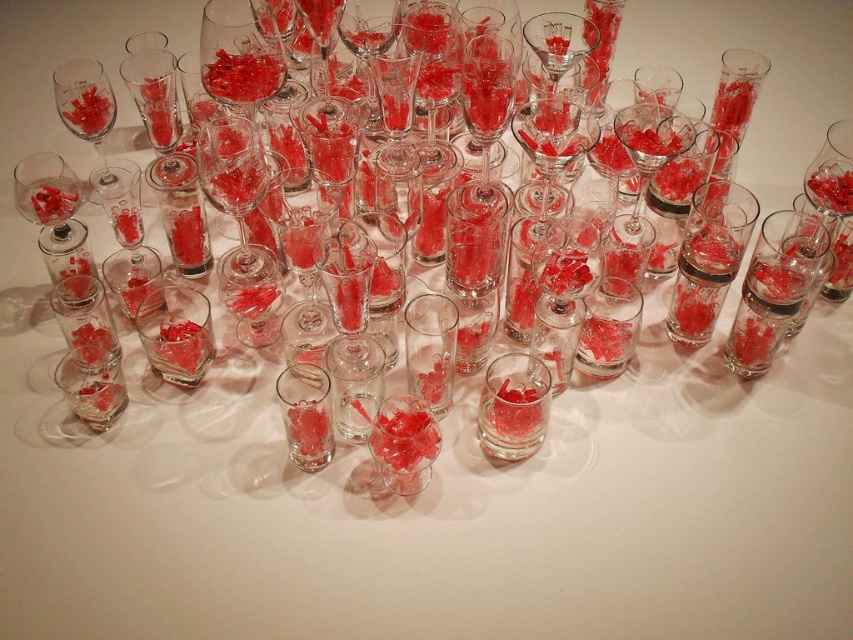
Question: Can you confirm if transparent glass at center is positioned to the left of matte glass wine glass at upper left?

Choices:
 (A) no
 (B) yes

Answer: (A)

Question: Which object is farther from the camera taking this photo?

Choices:
 (A) matte glass wine glass at upper left
 (B) transparent glass at center
 (C) transparent glass at right

Answer: (A)

Question: Is transparent glass at center below matte glass wine glass at upper left?

Choices:
 (A) no
 (B) yes

Answer: (B)

Question: Based on their relative distances, which object is farther from the matte glass wine glass at upper left?

Choices:
 (A) transparent glass at right
 (B) transparent glass at center

Answer: (A)

Question: Based on their relative distances, which object is nearer to the matte glass wine glass at upper left?

Choices:
 (A) transparent glass at right
 (B) transparent glass at center

Answer: (B)

Question: Is transparent glass at right above transparent glass at center?

Choices:
 (A) no
 (B) yes

Answer: (B)